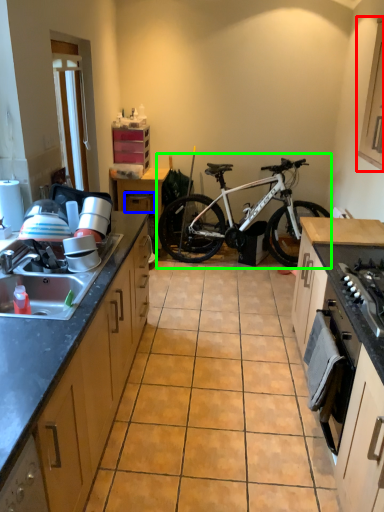
Question: Which is nearer to the cabinetry (highlighted by a red box)? drawer (highlighted by a blue box) or bicycle (highlighted by a green box).

Choices:
 (A) drawer
 (B) bicycle

Answer: (B)